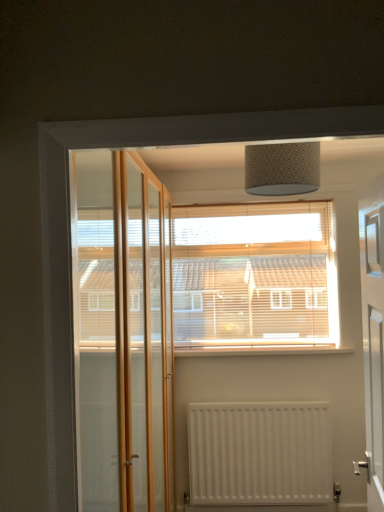
Question: Is wooden blinds at center next to white painted wood at center?

Choices:
 (A) no
 (B) yes

Answer: (A)

Question: Can you confirm if wooden blinds at center is bigger than white painted wood at center?

Choices:
 (A) yes
 (B) no

Answer: (A)

Question: Is white painted wood at center at the back of wooden blinds at center?

Choices:
 (A) yes
 (B) no

Answer: (B)

Question: Is wooden blinds at center wider than white painted wood at center?

Choices:
 (A) no
 (B) yes

Answer: (A)

Question: From the image's perspective, does wooden blinds at center appear lower than white painted wood at center?

Choices:
 (A) yes
 (B) no

Answer: (B)

Question: Is wooden blinds at center closer to camera compared to white painted wood at center?

Choices:
 (A) no
 (B) yes

Answer: (A)

Question: From a real-world perspective, is wooden blinds at center physically above white glossy door at right?

Choices:
 (A) no
 (B) yes

Answer: (B)

Question: Does wooden blinds at center contain white glossy door at right?

Choices:
 (A) no
 (B) yes

Answer: (A)

Question: Does wooden blinds at center have a smaller size compared to white glossy door at right?

Choices:
 (A) yes
 (B) no

Answer: (A)

Question: Is wooden blinds at center positioned far away from white glossy door at right?

Choices:
 (A) yes
 (B) no

Answer: (B)

Question: Is wooden blinds at center thinner than white glossy door at right?

Choices:
 (A) no
 (B) yes

Answer: (B)

Question: From a real-world perspective, is wooden blinds at center below white glossy door at right?

Choices:
 (A) no
 (B) yes

Answer: (A)

Question: Can you confirm if white glossy door at right is thinner than white painted wood at center?

Choices:
 (A) yes
 (B) no

Answer: (A)